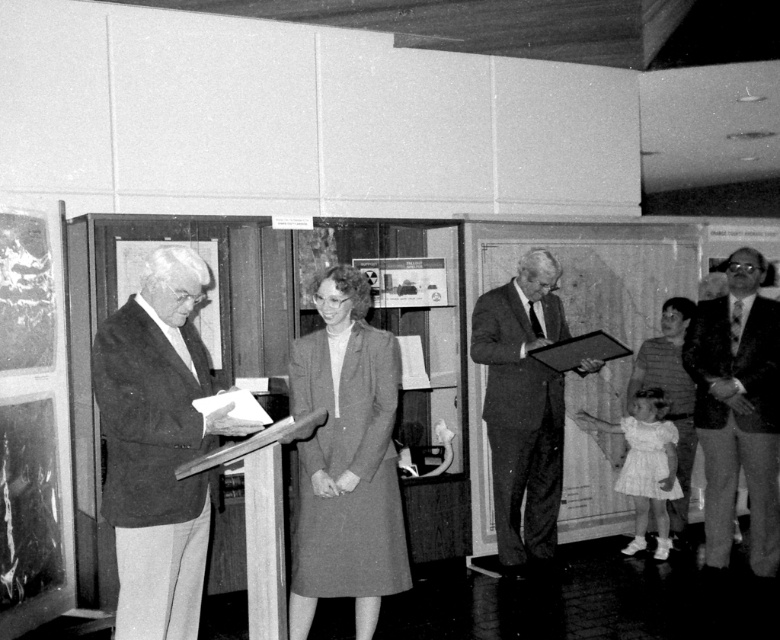
Question: Does matte gray coat at center appear on the left side of dark suit at right?

Choices:
 (A) no
 (B) yes

Answer: (B)

Question: Does smooth gray suit at left have a lesser width compared to dark suit at right?

Choices:
 (A) yes
 (B) no

Answer: (B)

Question: Which object is positioned farthest from the suit at center?

Choices:
 (A) dark suit at right
 (B) smooth gray suit at left
 (C) striped fabric dress at lower right

Answer: (B)

Question: Among these points, which one is nearest to the camera?

Choices:
 (A) (715, 525)
 (B) (176, 554)
 (C) (309, 480)
 (D) (628, 401)

Answer: (B)

Question: Estimate the real-world distances between objects in this image. Which object is closer to the suit at center?

Choices:
 (A) striped fabric dress at lower right
 (B) smooth gray suit at left
 (C) matte gray coat at center

Answer: (A)

Question: Can you confirm if smooth gray suit at left is wider than dark suit at right?

Choices:
 (A) yes
 (B) no

Answer: (A)